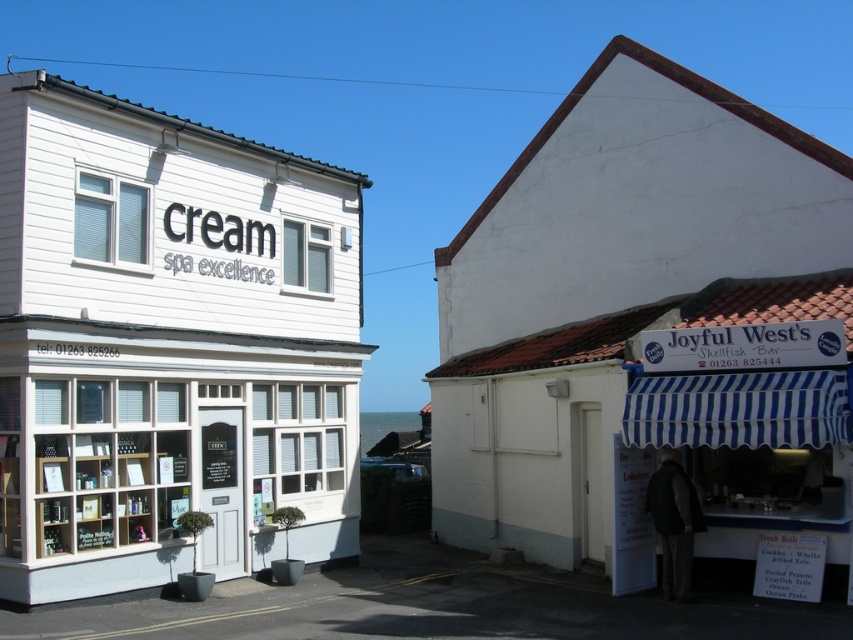
Question: Which of the following is the farthest from the observer?

Choices:
 (A) (x=550, y=252)
 (B) (x=107, y=588)

Answer: (A)

Question: Does white wood cream spa excellence at left appear under white painted wood shed at right?

Choices:
 (A) no
 (B) yes

Answer: (B)

Question: Is white wood cream spa excellence at left smaller than white painted wood shed at right?

Choices:
 (A) no
 (B) yes

Answer: (B)

Question: Is white wood cream spa excellence at left above white painted wood shed at right?

Choices:
 (A) yes
 (B) no

Answer: (B)

Question: Which point is closer to the camera?

Choices:
 (A) white wood cream spa excellence at left
 (B) white painted wood shed at right

Answer: (B)